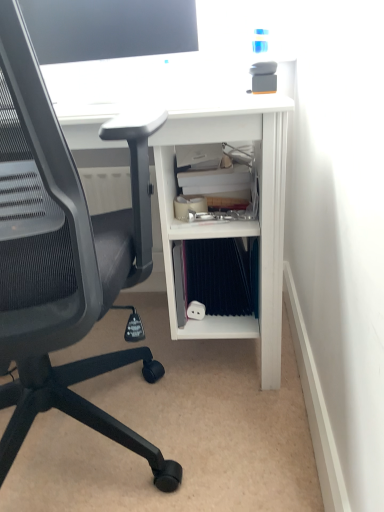
Question: Is white matte desk at center spatially inside black mesh chair at left, or outside of it?

Choices:
 (A) outside
 (B) inside

Answer: (A)

Question: Is white matte desk at center bigger or smaller than black mesh chair at left?

Choices:
 (A) small
 (B) big

Answer: (B)

Question: Which of these objects is positioned closest to the matte black monitor at upper center?

Choices:
 (A) black mesh chair at left
 (B) blue fabric binder at lower center
 (C) white matte desk at center

Answer: (C)

Question: Estimate the real-world distances between objects in this image. Which object is closer to the black mesh chair at left?

Choices:
 (A) blue fabric binder at lower center
 (B) white matte desk at center
 (C) matte black monitor at upper center

Answer: (B)